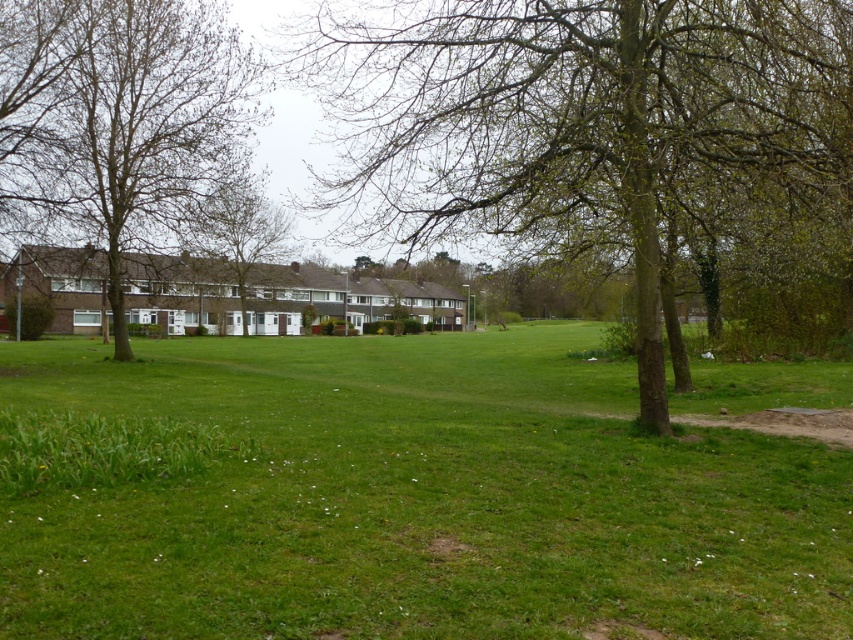
Question: Does brown leafless tree at left have a lesser width compared to brown textured tree at center?

Choices:
 (A) yes
 (B) no

Answer: (A)

Question: Which point appears closest to the camera in this image?

Choices:
 (A) [x=584, y=202]
 (B) [x=556, y=524]

Answer: (B)

Question: Can you confirm if green grassy field at center is positioned to the left of brown textured tree at center?

Choices:
 (A) yes
 (B) no

Answer: (B)

Question: In this image, where is brown rough tree at center located relative to brown textured tree at center?

Choices:
 (A) above
 (B) below

Answer: (A)

Question: Which point is closer to the camera?

Choices:
 (A) green grassy field at center
 (B) brown textured tree at center
 (C) brown leafless tree at left

Answer: (A)

Question: Estimate the real-world distances between objects in this image. Which object is farther from the brown rough tree at center?

Choices:
 (A) green grassy field at center
 (B) brown leafless tree at left

Answer: (B)